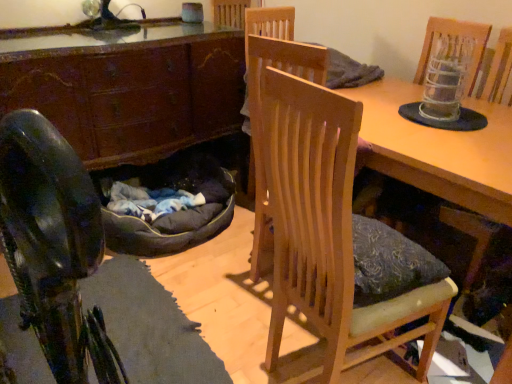
Question: Is dark brown wood cabinet at left taller or shorter than dark gray fabric bean bag at lower left?

Choices:
 (A) short
 (B) tall

Answer: (B)

Question: From a real-world perspective, is dark brown wood cabinet at left physically located above or below dark gray fabric bean bag at lower left?

Choices:
 (A) above
 (B) below

Answer: (A)

Question: Which of these objects is positioned farthest from the dark brown wood cabinet at left?

Choices:
 (A) wooden table at center
 (B) wooden chair at center
 (C) dark gray fabric bean bag at lower left

Answer: (A)

Question: Estimate the real-world distances between objects in this image. Which object is closer to the wooden table at center?

Choices:
 (A) dark brown wood cabinet at left
 (B) wooden chair at center
 (C) dark gray fabric bean bag at lower left

Answer: (B)